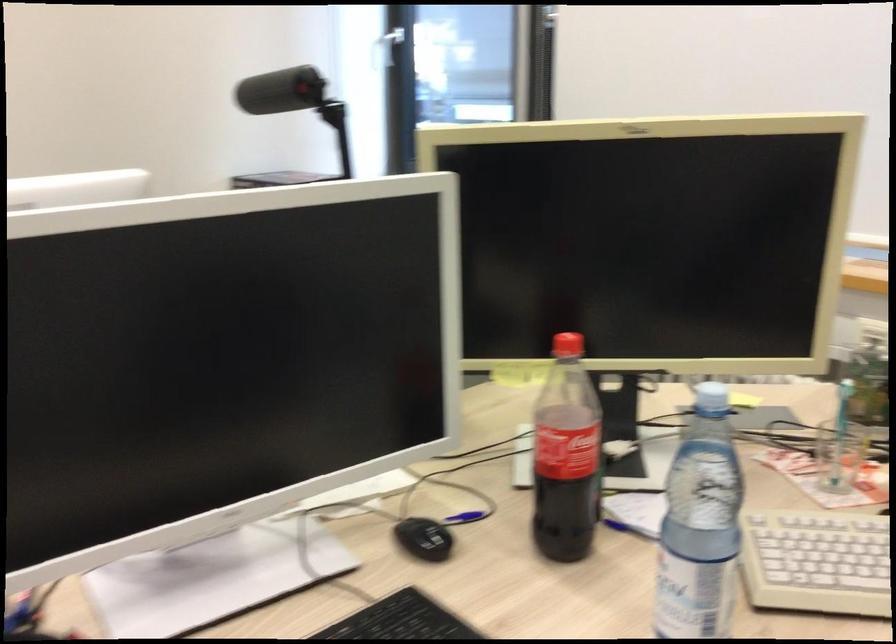
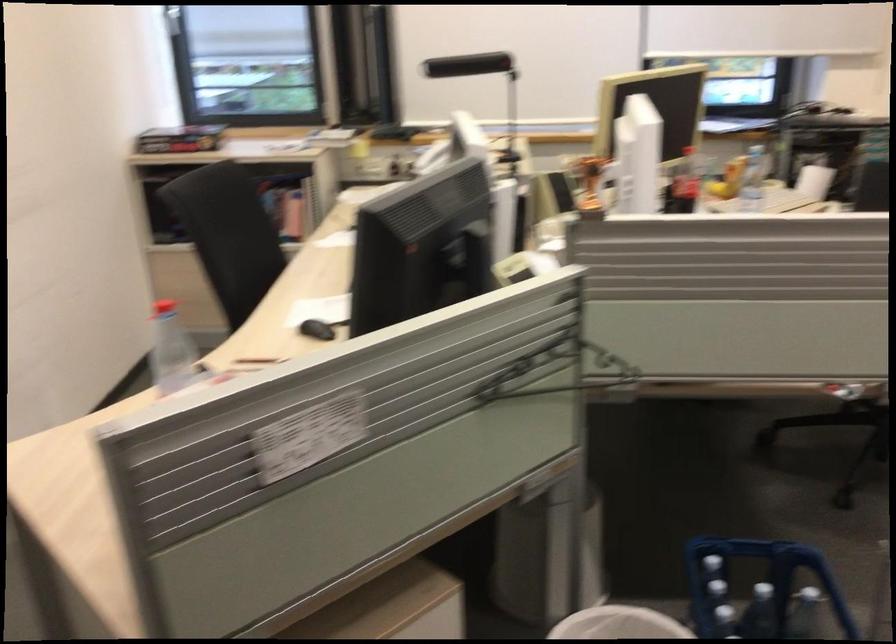
Locate, in the second image, the point that corresponds to pixel 711 398 in the first image.

(746, 143)